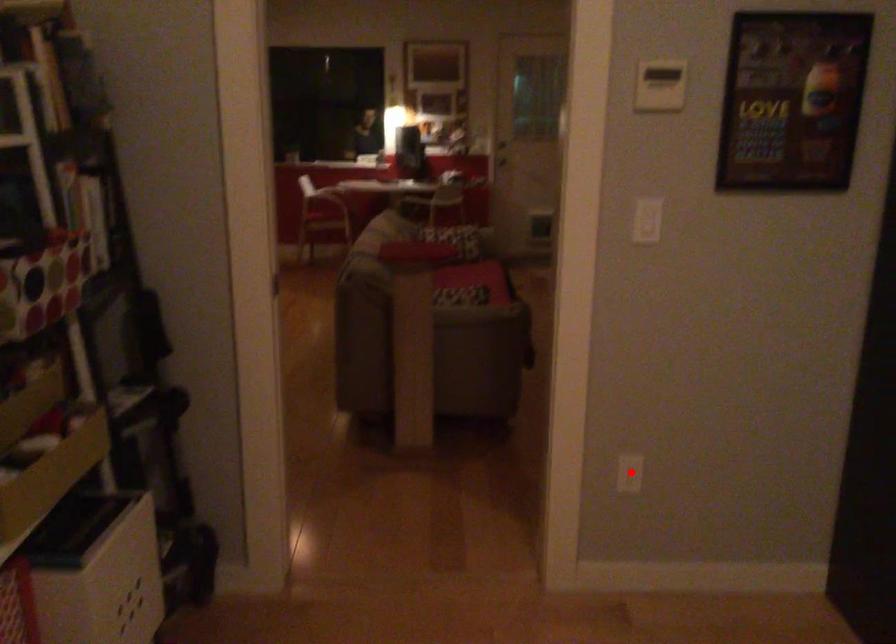
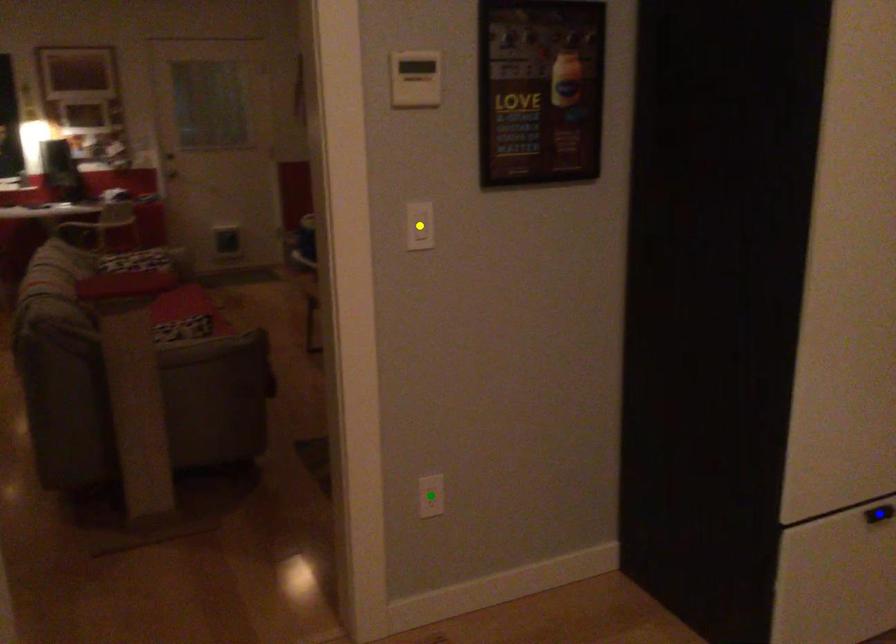
Question: I am providing you with two images of the same scene from different viewpoints. A red point is marked on the first image. You are given multiple points on the second image. In image 2, which mark is for the same physical point as the one in image 1?

Choices:
 (A) yellow point
 (B) green point
 (C) blue point

Answer: (B)